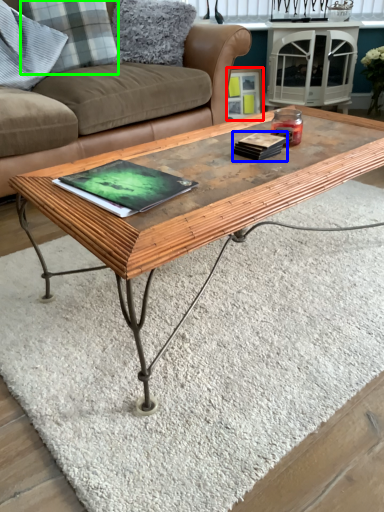
Question: Which object is positioned farthest from picture frame (highlighted by a red box)? Select from book (highlighted by a blue box) and pillow (highlighted by a green box).

Choices:
 (A) book
 (B) pillow

Answer: (A)